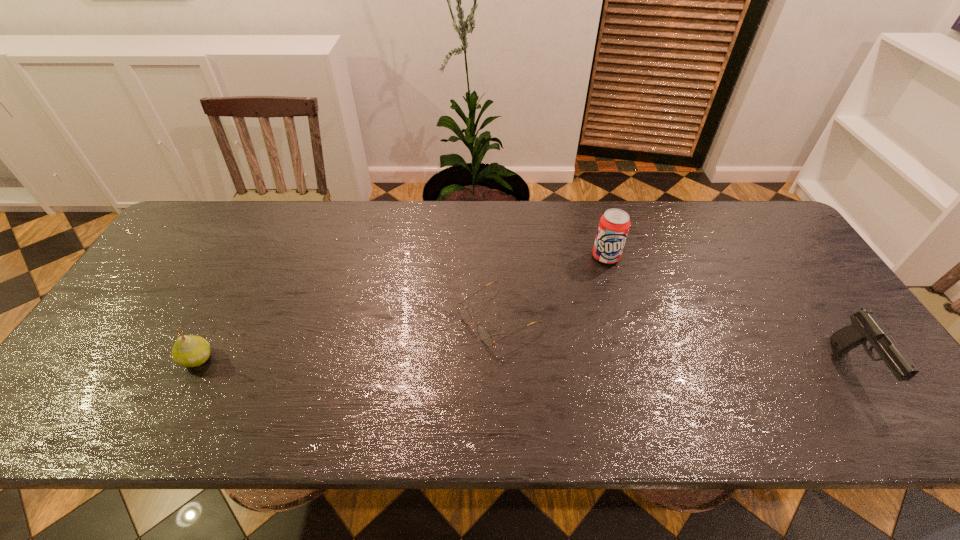
I want to click on vacant space located on the surface of the farthest object, so click(x=599, y=303).

In order to click on free space located 0.380m on the surface of the farthest object in this screenshot , I will do (588, 375).

Where is `free space located 0.290m on the surface of the farthest object`? free space located 0.290m on the surface of the farthest object is located at coordinates (592, 345).

The height and width of the screenshot is (540, 960). Find the location of `object that is at the far edge`. object that is at the far edge is located at coordinates (614, 224).

Locate an element on the screen. The image size is (960, 540). pear located in the near edge section of the desktop is located at coordinates (188, 351).

Identify the location of pistol present at the near edge. (865, 326).

At what (x,y) coordinates should I click in order to perform the action: click on object that is at the right edge. Please return your answer as a coordinate pair (x, y). Looking at the image, I should click on (865, 326).

The image size is (960, 540). In order to click on object that is at the near right corner in this screenshot , I will do `click(865, 326)`.

The width and height of the screenshot is (960, 540). I want to click on free location at the far edge of the desktop, so click(527, 248).

At what (x,y) coordinates should I click in order to perform the action: click on free space at the near edge. Please return your answer as a coordinate pair (x, y). The image size is (960, 540). Looking at the image, I should click on (582, 366).